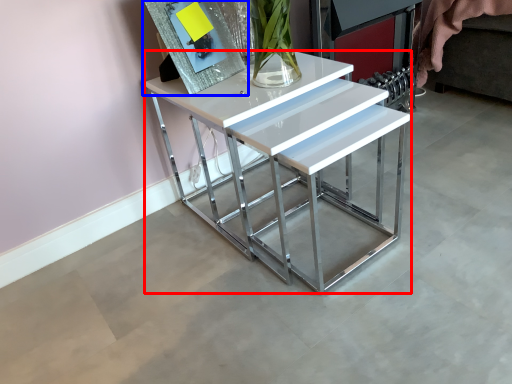
Question: Which of the following is the closest to the observer, table (highlighted by a red box) or picture frame (highlighted by a blue box)?

Choices:
 (A) table
 (B) picture frame

Answer: (A)